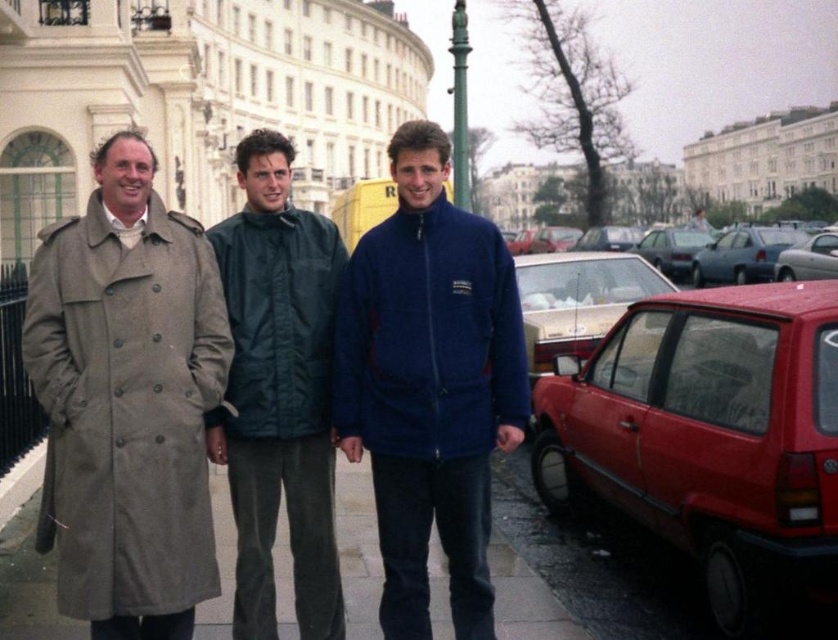
The image size is (838, 640). In order to click on light brown fabric trench coat at left in this screenshot , I will do `click(127, 401)`.

Is point (111, 429) closer to camera compared to point (756, 237)?

That is True.

In order to click on light brown fabric trench coat at left in this screenshot , I will do `click(127, 401)`.

Is point (319, 600) in front of point (348, 612)?

Yes, it is in front of point (348, 612).

At what (x,y) coordinates should I click in order to perform the action: click on green fabric jacket at center. Please return your answer as a coordinate pair (x, y). The image size is (838, 640). Looking at the image, I should click on (278, 392).

Identify the location of green fabric jacket at center. The height and width of the screenshot is (640, 838). (278, 392).

Can you confirm if light brown fabric trench coat at left is thinner than navy fleece jacket at center?

No, light brown fabric trench coat at left is not thinner than navy fleece jacket at center.

Is light brown fabric trench coat at left shorter than navy fleece jacket at center?

No, light brown fabric trench coat at left is not shorter than navy fleece jacket at center.

Describe the element at coordinates (127, 401) in the screenshot. I see `light brown fabric trench coat at left` at that location.

The width and height of the screenshot is (838, 640). In order to click on light brown fabric trench coat at left in this screenshot , I will do `click(127, 401)`.